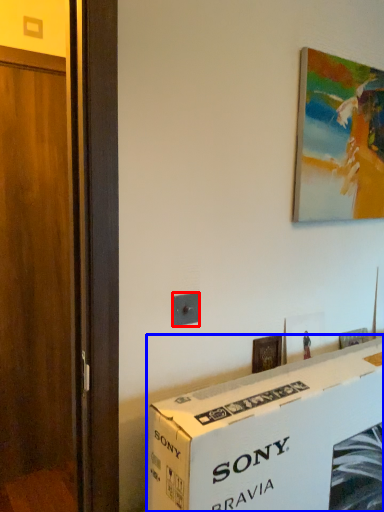
Question: Among these objects, which one is nearest to the camera, electric outlet (highlighted by a red box) or box (highlighted by a blue box)?

Choices:
 (A) electric outlet
 (B) box

Answer: (B)